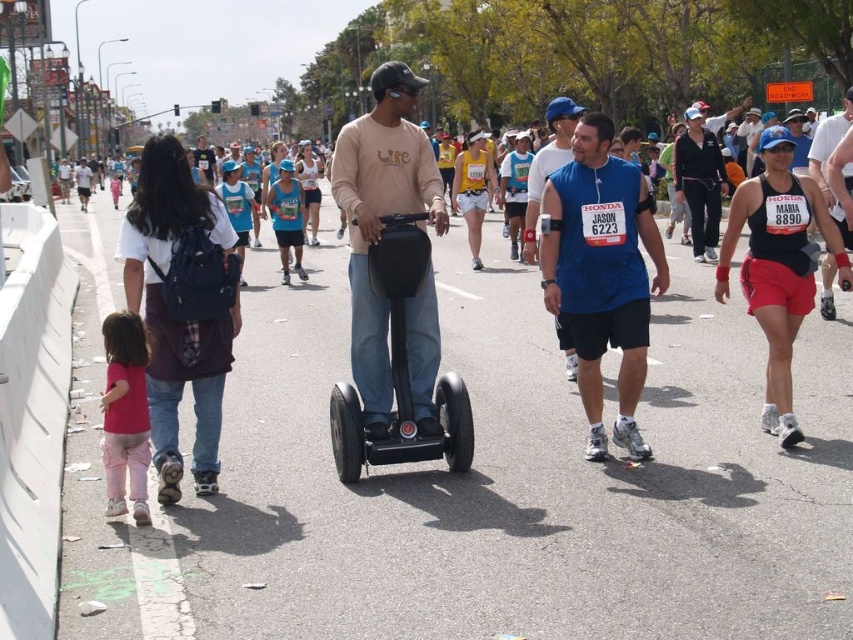
Question: Considering the real-world distances, which object is closest to the blue fabric shirt at center?

Choices:
 (A) matte blue tank top at right
 (B) dark brown backpack at left

Answer: (B)

Question: Where is blue fabric shirt at center located in relation to matte beige sweatshirt at center in the image?

Choices:
 (A) below
 (B) above

Answer: (A)

Question: Which object is farther from the camera taking this photo?

Choices:
 (A) black rubber scooter at center
 (B) dark brown backpack at left
 (C) matte blue tank top at right
 (D) matte black segway at center

Answer: (D)

Question: From the image, what is the correct spatial relationship of black matte tank top at right in relation to blue fabric tank top at center?

Choices:
 (A) below
 (B) above

Answer: (A)

Question: Which object is the farthest from the blue fabric tank top at center?

Choices:
 (A) matte beige sweatshirt at center
 (B) dark brown backpack at left
 (C) matte black segway at center
 (D) black matte tank top at right

Answer: (C)

Question: Does blue fabric tank top at center lie behind matte black segway at center?

Choices:
 (A) no
 (B) yes

Answer: (A)